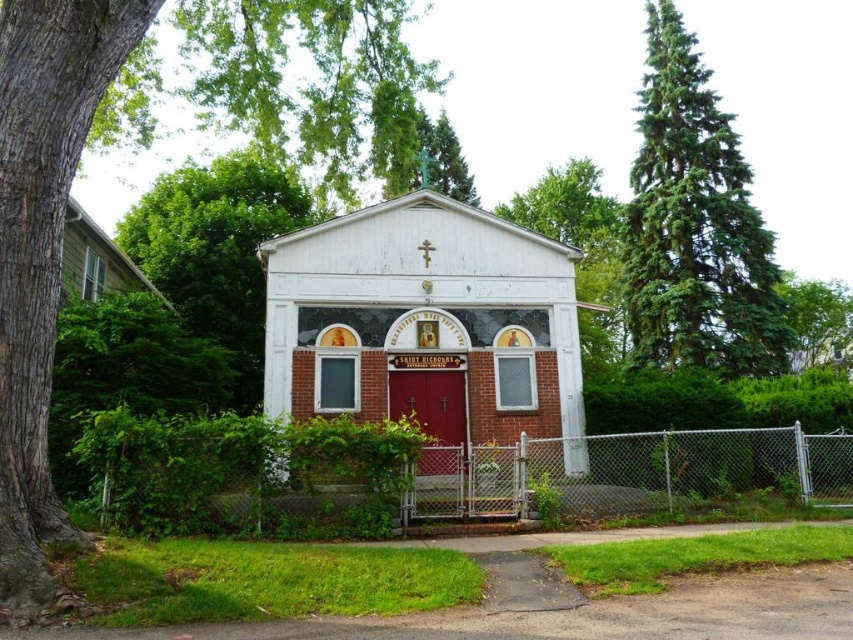
You are standing at the entrance of the church and want to take a photo of both the smooth bark tree at left and the green coniferous tree at right. Which tree should you position yourself closer to in order to include both in the frame?

You should position yourself closer to the smooth bark tree at left because it is located below the green coniferous tree at right, allowing both to be captured in the frame when closer to the lower positioned tree.